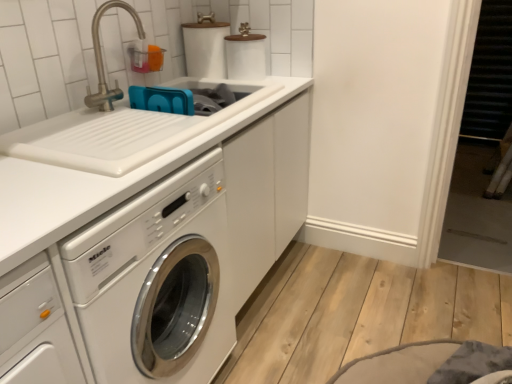
Question: Considering their positions, is white glossy washing machine at center-left located in front of or behind white glossy sink at upper left?

Choices:
 (A) front
 (B) behind

Answer: (A)

Question: Is white glossy washing machine at center-left bigger or smaller than white glossy sink at upper left?

Choices:
 (A) big
 (B) small

Answer: (A)

Question: Considering the real-world distances, which object is closest to the brushed metal faucet at upper left?

Choices:
 (A) white glossy washing machine at center-left
 (B) white glossy sink at upper left
 (C) white matte toilet paper at upper center

Answer: (C)

Question: Considering the real-world distances, which object is farthest from the white glossy washing machine at center-left?

Choices:
 (A) white matte toilet paper at upper center
 (B) white glossy sink at upper left
 (C) brushed metal faucet at upper left

Answer: (A)